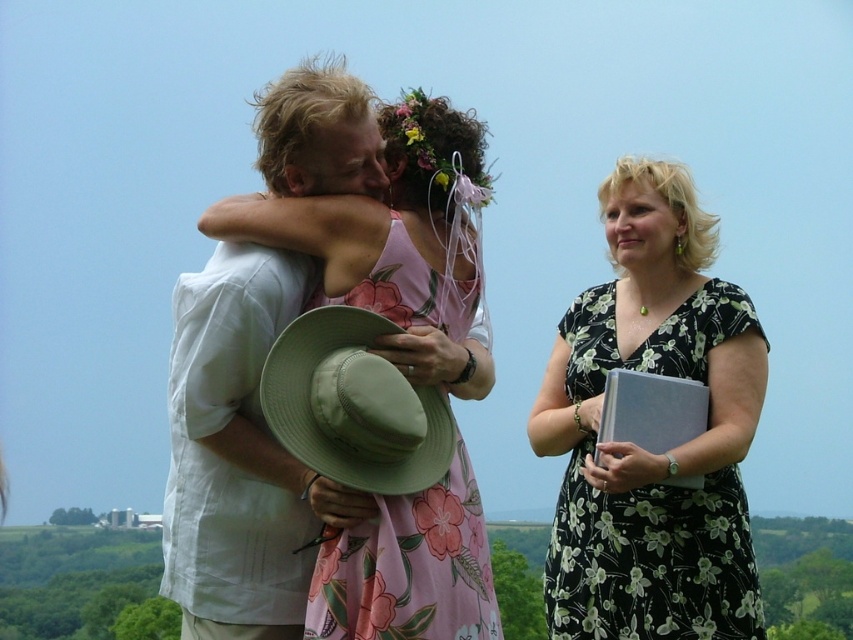
The image size is (853, 640). What are the coordinates of `black floral dress at right` in the screenshot? It's located at (651, 561).

Can you confirm if black floral dress at right is positioned above pink floral fabric dress at center?

Indeed, black floral dress at right is positioned over pink floral fabric dress at center.

At what (x,y) coordinates should I click in order to perform the action: click on black floral dress at right. Please return your answer as a coordinate pair (x, y). The image size is (853, 640). Looking at the image, I should click on (651, 561).

Which is above, light beige cotton shirt at center or black floral dress at right?

light beige cotton shirt at center is above.

Is light beige cotton shirt at center smaller than black floral dress at right?

No, light beige cotton shirt at center is not smaller than black floral dress at right.

Looking at this image, who is more forward, (717, 410) or (728, 536)?

Positioned in front is point (717, 410).

I want to click on light beige cotton shirt at center, so click(x=389, y=236).

Can you confirm if light beige cotton shirt at center is shorter than white linen shirt at center?

Yes, light beige cotton shirt at center is shorter than white linen shirt at center.

Who is positioned more to the left, light beige cotton shirt at center or white linen shirt at center?

white linen shirt at center

At what (x,y) coordinates should I click in order to perform the action: click on light beige cotton shirt at center. Please return your answer as a coordinate pair (x, y). The width and height of the screenshot is (853, 640). Looking at the image, I should click on (389, 236).

In order to click on light beige cotton shirt at center in this screenshot , I will do `click(389, 236)`.